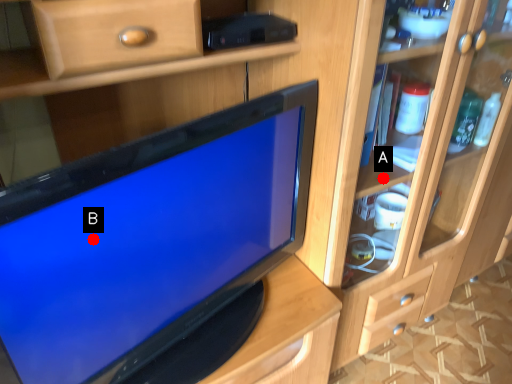
Question: Two points are circled on the image, labeled by A and B beside each circle. Which point is closer to the camera?

Choices:
 (A) A is closer
 (B) B is closer

Answer: (B)